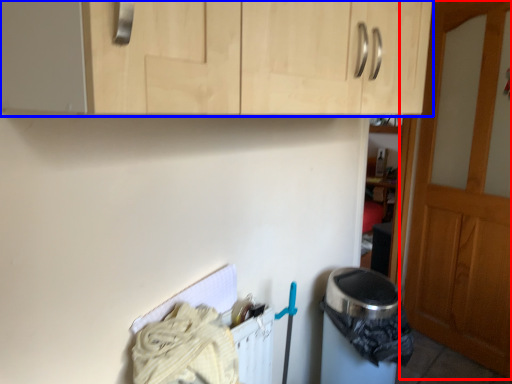
Question: Which object appears farthest to the camera in this image, door (highlighted by a red box) or cabinetry (highlighted by a blue box)?

Choices:
 (A) door
 (B) cabinetry

Answer: (A)